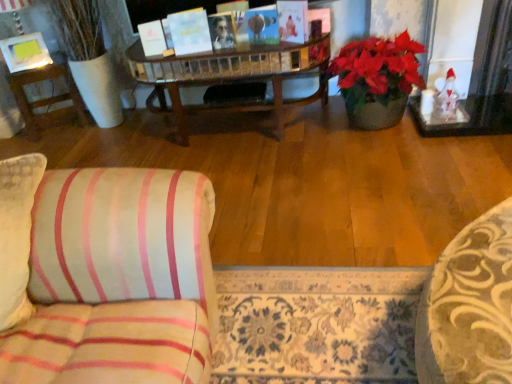
Identify the location of vacant space to the right of wooden side table at left. The image size is (512, 384). (101, 129).